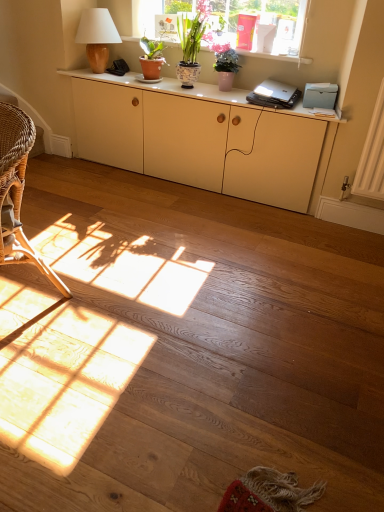
Where is `vacant space in front of pink ceramic vase at upper center, which is the first houseplant from right to left`? This screenshot has height=512, width=384. vacant space in front of pink ceramic vase at upper center, which is the first houseplant from right to left is located at coordinates (235, 95).